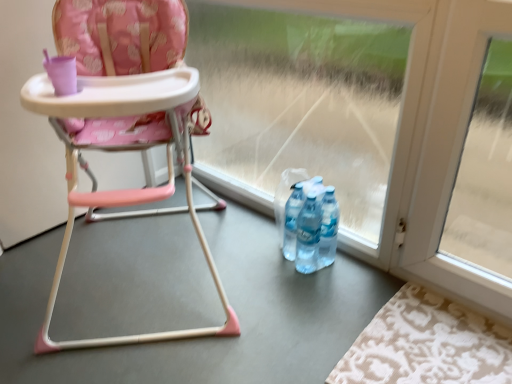
Locate an element on the screen. This screenshot has width=512, height=384. vacant space underneath beige damask rug at lower right (from a real-world perspective) is located at coordinates click(432, 347).